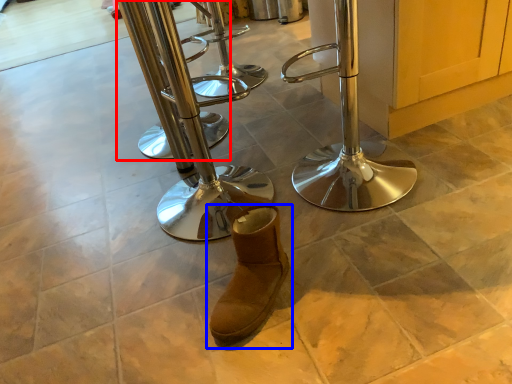
Question: Which object is further to the camera taking this photo, step stool (highlighted by a red box) or footwear (highlighted by a blue box)?

Choices:
 (A) step stool
 (B) footwear

Answer: (A)